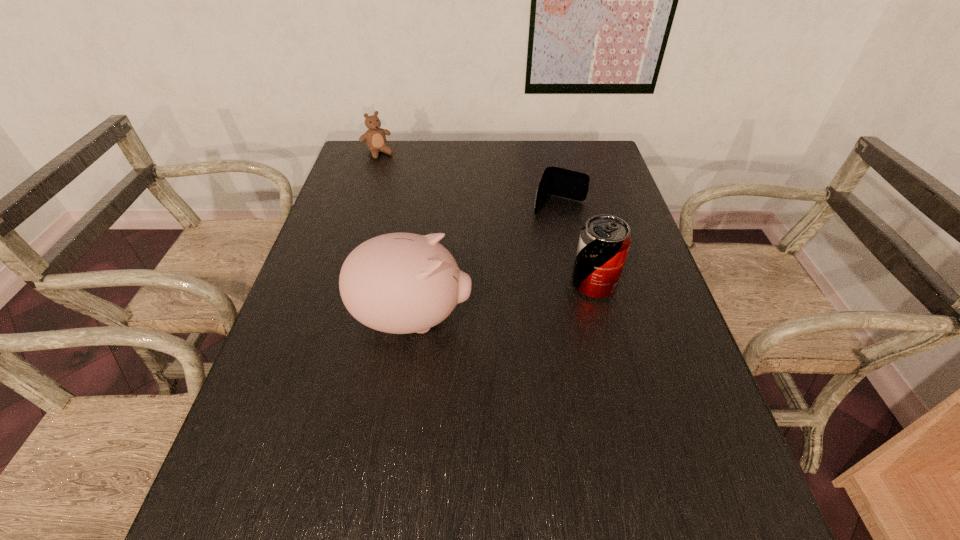
What are the coordinates of `free point between the second farthest object and the piggy bank` in the screenshot? It's located at (486, 262).

Where is `free space that is in between the farthest object and the shortest object`? free space that is in between the farthest object and the shortest object is located at coordinates (468, 179).

At what (x,y) coordinates should I click in order to perform the action: click on vacant space that's between the second shortest object and the wallet. Please return your answer as a coordinate pair (x, y). The width and height of the screenshot is (960, 540). Looking at the image, I should click on coord(468,179).

The width and height of the screenshot is (960, 540). Identify the location of vacant point located between the leftmost object and the wallet. (468, 179).

Find the location of a particular element. object identified as the second closest to the teddy bear is located at coordinates (400, 283).

Where is `object that is the closest one to the soda can`? This screenshot has width=960, height=540. object that is the closest one to the soda can is located at coordinates click(x=556, y=181).

Identify the location of free space that satisfies the following two spatial constraints: 1. on the front side of the third shortest object; 2. on the left side of the third nearest object. (576, 284).

At what (x,y) coordinates should I click in order to perform the action: click on vacant region that satisfies the following two spatial constraints: 1. on the front side of the leftmost object; 2. on the right side of the shortest object. Please return your answer as a coordinate pair (x, y). The image size is (960, 540). Looking at the image, I should click on (361, 205).